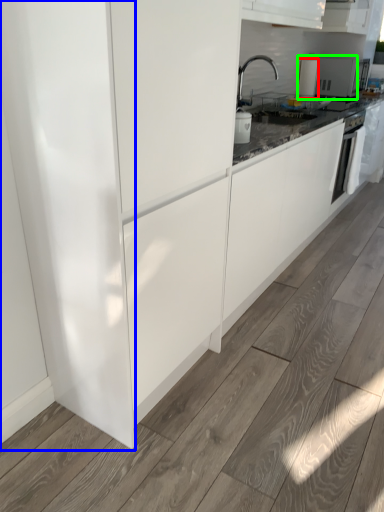
Question: Which is farther away from kitchen appliance (highlighted by a red box)? glass door (highlighted by a blue box) or appliance (highlighted by a green box)?

Choices:
 (A) glass door
 (B) appliance

Answer: (A)